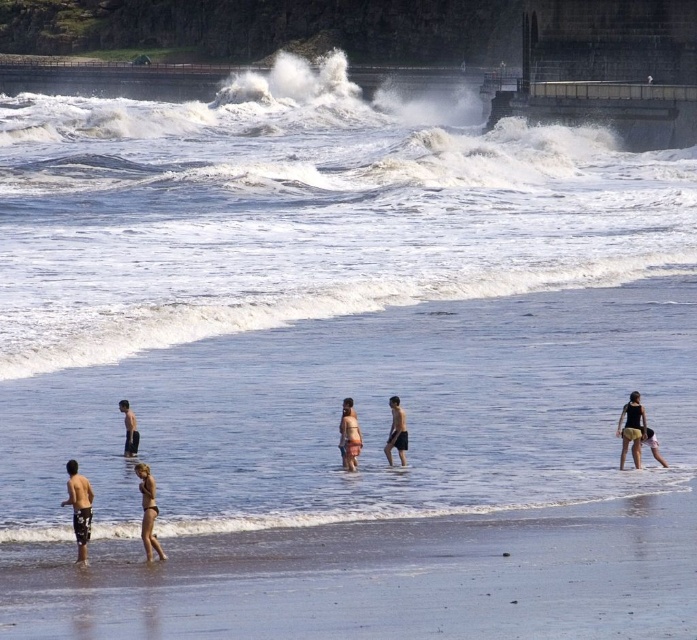
Between point (346, 419) and point (405, 461), which one is positioned behind?

The point (405, 461) is behind.

Between tan skin human at center and black matte shorts at center, which one is positioned lower?

Positioned lower is black matte shorts at center.

Locate an element on the screen. tan skin human at center is located at coordinates (348, 435).

Which is more to the right, black matte shorts at center or skinny man at lower left?

black matte shorts at center is more to the right.

Who is more forward, (399, 451) or (128, 440)?

Point (399, 451)

Between point (388, 451) and point (135, 452), which one is positioned behind?

The point (388, 451) is behind.

This screenshot has height=640, width=697. In order to click on black matte shorts at center in this screenshot , I will do `click(397, 433)`.

This screenshot has height=640, width=697. What do you see at coordinates (130, 428) in the screenshot?
I see `skinny man at lower left` at bounding box center [130, 428].

Is skinny man at lower left shorter than tan skin human at lower right?

No.

The height and width of the screenshot is (640, 697). Describe the element at coordinates (130, 428) in the screenshot. I see `skinny man at lower left` at that location.

Locate an element on the screen. skinny man at lower left is located at coordinates (130, 428).